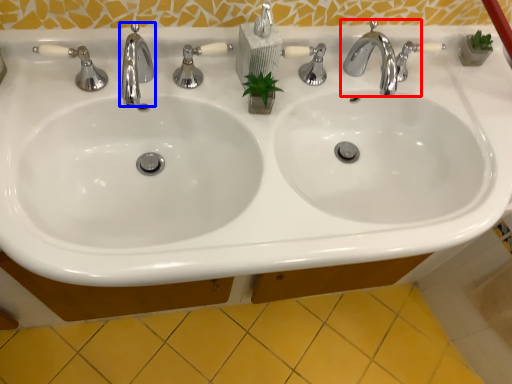
Question: Among these objects, which one is nearest to the camera, tap (highlighted by a red box) or tap (highlighted by a blue box)?

Choices:
 (A) tap
 (B) tap

Answer: (B)